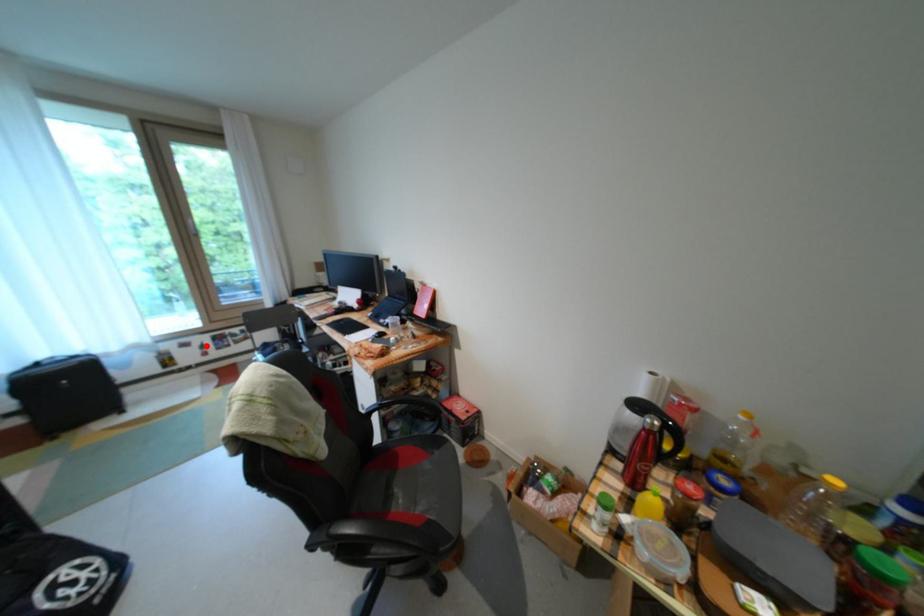
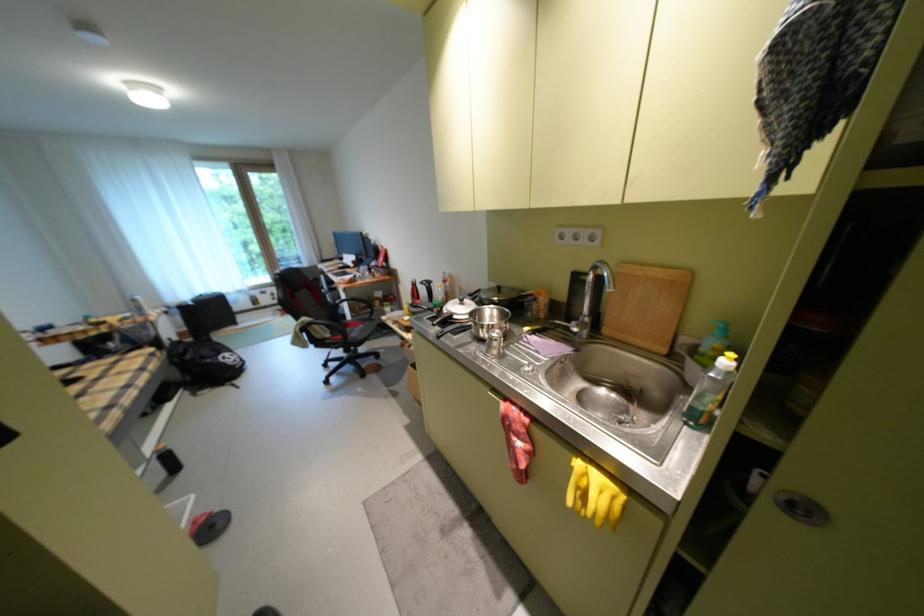
Question: I am providing you with two images of the same scene from different viewpoints. In image1, a red point is highlighted. Considering the same 3D point in image2, which of the following is correct?

Choices:
 (A) It is closer
 (B) It is farther

Answer: (B)